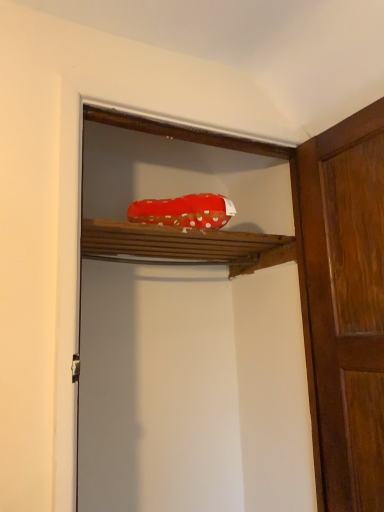
At what (x,y) coordinates should I click in order to perform the action: click on wooden door at right. Please return your answer as a coordinate pair (x, y). Looking at the image, I should click on (347, 302).

The width and height of the screenshot is (384, 512). I want to click on wooden door at right, so click(x=347, y=302).

Based on the photo, which is less distant, (131, 411) or (187, 227)?

The point (187, 227) is in front.

Which object is further away from the camera taking this photo, red fabric shoe at upper center or red polka dot fabric at upper center?

red polka dot fabric at upper center is more distant.

Where is `material above the red fabric shoe at upper center (from a real-world perspective)`? This screenshot has width=384, height=512. material above the red fabric shoe at upper center (from a real-world perspective) is located at coordinates (184, 211).

Is red fabric shoe at upper center to the left of red polka dot fabric at upper center from the viewer's perspective?

No, red fabric shoe at upper center is not to the left of red polka dot fabric at upper center.

Which of these two, wooden door at right or red fabric shoe at upper center, stands shorter?

With less height is wooden door at right.

Consider the image. Can you confirm if wooden door at right is bigger than red fabric shoe at upper center?

No, wooden door at right is not bigger than red fabric shoe at upper center.

In the scene shown: From a real-world perspective, is wooden door at right on top of red fabric shoe at upper center?

No, from a real-world perspective, wooden door at right is not above red fabric shoe at upper center.

Considering the relative sizes of wooden door at right and red fabric shoe at upper center in the image provided, is wooden door at right wider than red fabric shoe at upper center?

In fact, wooden door at right might be narrower than red fabric shoe at upper center.

From the image's perspective, is wooden door at right above red polka dot fabric at upper center?

No, from the image's perspective, wooden door at right is not over red polka dot fabric at upper center.

From a real-world perspective, between wooden door at right and red polka dot fabric at upper center, who is vertically higher?

From a 3D spatial view, red polka dot fabric at upper center is above.

Is wooden door at right touching red polka dot fabric at upper center?

wooden door at right and red polka dot fabric at upper center are clearly separated.

Looking at the image, does wooden door at right seem bigger or smaller compared to red polka dot fabric at upper center?

wooden door at right is bigger than red polka dot fabric at upper center.

Would you say wooden door at right is part of red fabric shoe at upper center's contents?

No, wooden door at right is not a part of red fabric shoe at upper center.

Which object is thinner, red fabric shoe at upper center or wooden door at right?

wooden door at right.

At what (x,y) coordinates should I click in order to perform the action: click on cabinetry above the wooden door at right (from a real-world perspective). Please return your answer as a coordinate pair (x, y). This screenshot has height=512, width=384. Looking at the image, I should click on (190, 329).

Is red fabric shoe at upper center oriented away from wooden door at right?

That's not correct — red fabric shoe at upper center is not looking away from wooden door at right.

Who is more distant, red polka dot fabric at upper center or red fabric shoe at upper center?

red polka dot fabric at upper center is behind.

Would you say red polka dot fabric at upper center is inside or outside red fabric shoe at upper center?

red polka dot fabric at upper center is spatially positioned inside red fabric shoe at upper center.

Is the surface of red polka dot fabric at upper center in direct contact with red fabric shoe at upper center?

There is a gap between red polka dot fabric at upper center and red fabric shoe at upper center.

How distant is red polka dot fabric at upper center from red fabric shoe at upper center?

A distance of 16.97 inches exists between red polka dot fabric at upper center and red fabric shoe at upper center.

Between red polka dot fabric at upper center and wooden door at right, which one appears on the left side from the viewer's perspective?

Positioned to the left is red polka dot fabric at upper center.

Is there a large distance between red polka dot fabric at upper center and wooden door at right?

No, red polka dot fabric at upper center is not far away from wooden door at right.

In the scene shown: Is red polka dot fabric at upper center bigger or smaller than wooden door at right?

In the image, red polka dot fabric at upper center appears to be smaller than wooden door at right.

Can you confirm if red polka dot fabric at upper center is thinner than wooden door at right?

In fact, red polka dot fabric at upper center might be wider than wooden door at right.

The width and height of the screenshot is (384, 512). In order to click on cabinetry below the red polka dot fabric at upper center (from a real-world perspective) in this screenshot , I will do pyautogui.click(x=190, y=329).

At what (x,y) coordinates should I click in order to perform the action: click on cabinetry above the wooden door at right (from the image's perspective). Please return your answer as a coordinate pair (x, y). This screenshot has width=384, height=512. Looking at the image, I should click on (190, 329).

From the image, which object appears to be farther from red polka dot fabric at upper center, red fabric shoe at upper center or wooden door at right?

The object further to red polka dot fabric at upper center is red fabric shoe at upper center.

Considering their positions, is wooden door at right positioned closer to red fabric shoe at upper center than red polka dot fabric at upper center?

wooden door at right is closer to red fabric shoe at upper center.

Estimate the real-world distances between objects in this image. Which object is closer to red polka dot fabric at upper center, wooden door at right or red fabric shoe at upper center?

Based on the image, wooden door at right appears to be nearer to red polka dot fabric at upper center.

Considering their positions, is red polka dot fabric at upper center positioned closer to red fabric shoe at upper center than wooden door at right?

Based on the image, wooden door at right appears to be nearer to red fabric shoe at upper center.

Looking at the image, which one is located closer to wooden door at right, red fabric shoe at upper center or red polka dot fabric at upper center?

red fabric shoe at upper center is closer to wooden door at right.

Estimate the real-world distances between objects in this image. Which object is closer to wooden door at right, red polka dot fabric at upper center or red fabric shoe at upper center?

red fabric shoe at upper center lies closer to wooden door at right than the other object.

In order to click on cabinetry between red polka dot fabric at upper center and wooden door at right from left to right in this screenshot , I will do `click(190, 329)`.